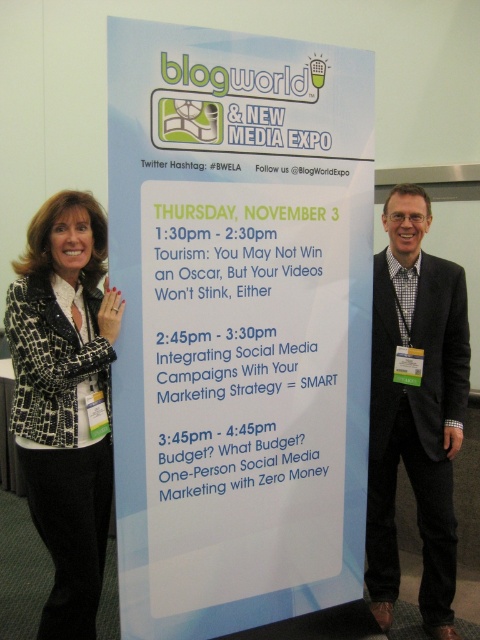
Is the point at coordinates (x=294, y=132) on the banner closer than 3 meters to the viewer?

Yes, the point at coordinates (x=294, y=132) is 2.00 meters from the viewer, which is within the 3 meter threshold.

Based on the banner, which point, point A at coordinates [350,104] or point B at coordinates [12,294], is located behind the other?

Point A at coordinates [350,104] is behind point B at coordinates [12,294].

You are attending the Blogworld event and see the leopard print blazer at left and the black suit at right on the banner. Which clothing item is placed higher on the banner?

The leopard print blazer at left is positioned over the black suit at right, so it is placed higher on the banner.